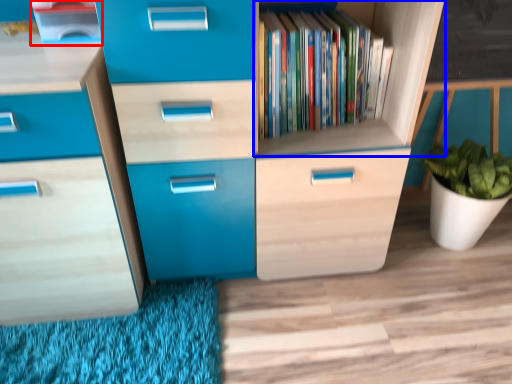
Question: Which object appears closest to the camera in this image, cabinetry (highlighted by a red box) or shelf (highlighted by a blue box)?

Choices:
 (A) cabinetry
 (B) shelf

Answer: (A)